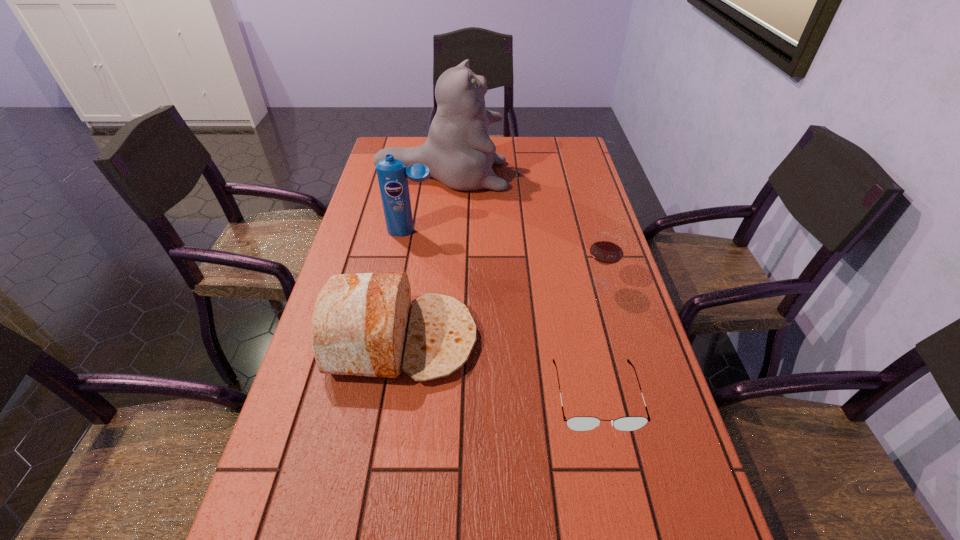
In the image, there is a desktop. At what (x,y) coordinates should I click in order to perform the action: click on free region at the right edge. Please return your answer as a coordinate pair (x, y). Looking at the image, I should click on (566, 173).

In order to click on blank space at the far right corner of the desktop in this screenshot , I will do `click(544, 146)`.

You are a GUI agent. You are given a task and a screenshot of the screen. Output one action in this format:
    pyautogui.click(x=<x>, y=<y>)
    Task: Click on the free point between the farthest object and the bread
    The width and height of the screenshot is (960, 540).
    Given the screenshot: What is the action you would take?
    421,258

You are a GUI agent. You are given a task and a screenshot of the screen. Output one action in this format:
    pyautogui.click(x=<x>, y=<y>)
    Task: Click on the vacant space in between the bread and the spectacles
    Image resolution: width=960 pixels, height=540 pixels.
    Given the screenshot: What is the action you would take?
    pyautogui.click(x=498, y=368)

I want to click on empty location between the cat and the wineglass, so click(x=519, y=231).

The image size is (960, 540). Find the location of `free space between the shampoo and the spectacles`. free space between the shampoo and the spectacles is located at coordinates (504, 314).

Identify the location of vacant area that lies between the bread and the spectacles. (498, 368).

Image resolution: width=960 pixels, height=540 pixels. What are the coordinates of `free space between the spectacles and the bread` in the screenshot? It's located at (498, 368).

Where is `unoccupied position between the farthest object and the third farthest object`? unoccupied position between the farthest object and the third farthest object is located at coordinates (519, 231).

Where is `the second closest object to the farthest object`? the second closest object to the farthest object is located at coordinates (607, 248).